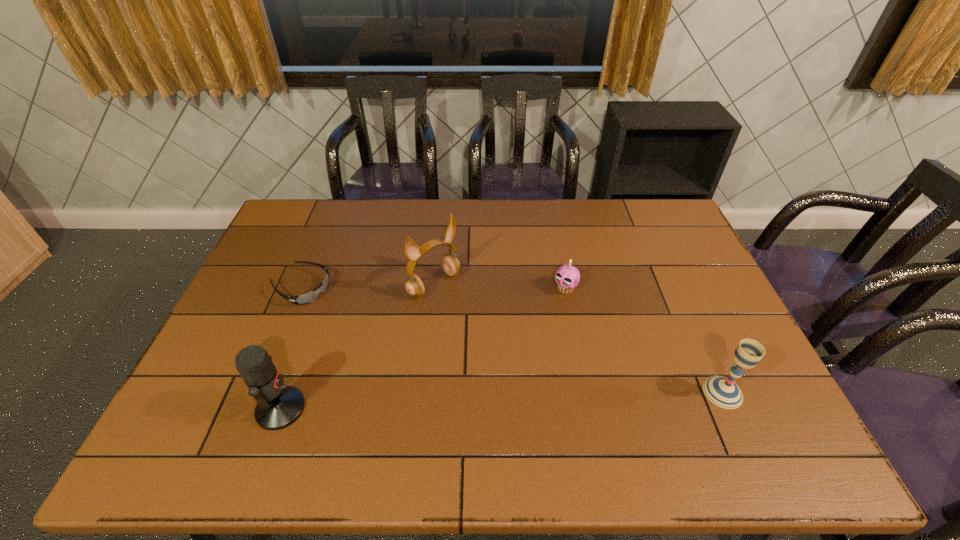
Locate an element on the screen. The image size is (960, 540). free space that satisfies the following two spatial constraints: 1. on the back side of the sunglasses; 2. on the left side of the earphone is located at coordinates (303, 284).

Identify the location of vacant space that satisfies the following two spatial constraints: 1. on the back side of the shortest object; 2. on the left side of the earphone. This screenshot has width=960, height=540. (303, 284).

Where is `free space that satisfies the following two spatial constraints: 1. on the front side of the sunglasses; 2. on the side of the microphone with the red ring`? The image size is (960, 540). free space that satisfies the following two spatial constraints: 1. on the front side of the sunglasses; 2. on the side of the microphone with the red ring is located at coordinates (252, 409).

You are a GUI agent. You are given a task and a screenshot of the screen. Output one action in this format:
    pyautogui.click(x=<x>, y=<y>)
    Task: Click on the vacant point that satisfies the following two spatial constraints: 1. on the front side of the microphone; 2. on the side of the sunglasses with the red ring
    The height and width of the screenshot is (540, 960).
    Given the screenshot: What is the action you would take?
    pyautogui.click(x=252, y=409)